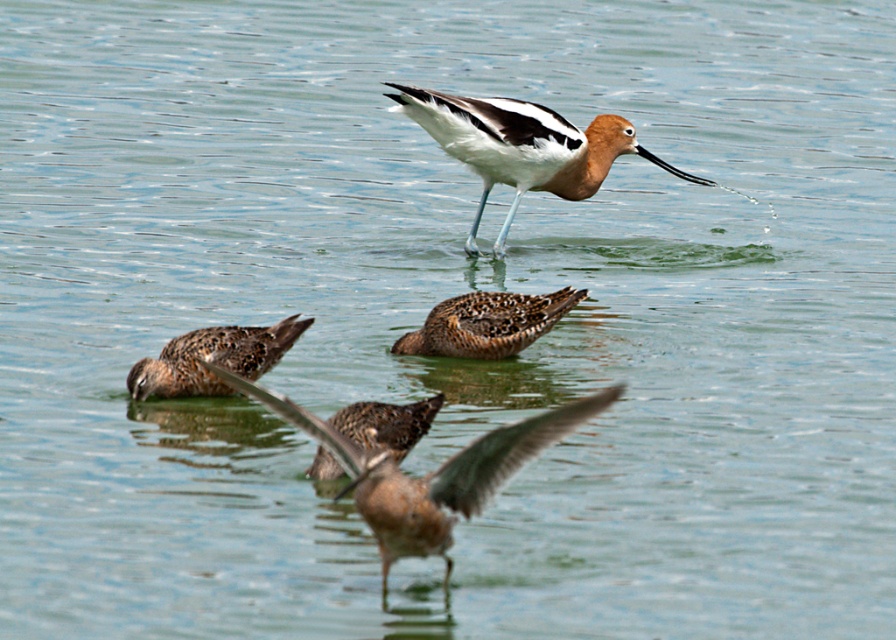
Question: Which is nearer to the brown speckled bird at center?

Choices:
 (A) brown speckled duck at lower center
 (B) brown speckled duck at center
 (C) brown speckled duck at lower left

Answer: (A)

Question: Can you confirm if brown speckled duck at lower left is wider than brown speckled duck at lower center?

Choices:
 (A) yes
 (B) no

Answer: (A)

Question: Observing the image, what is the correct spatial positioning of brown speckled bird at center in reference to brown speckled duck at center?

Choices:
 (A) left
 (B) right

Answer: (A)

Question: Is brown speckled bird at center behind brown speckled duck at lower center?

Choices:
 (A) yes
 (B) no

Answer: (B)

Question: Which point is farther from the camera taking this photo?

Choices:
 (A) (225, 381)
 (B) (562, 120)
 (C) (191, 355)

Answer: (B)

Question: Among these points, which one is nearest to the camera?

Choices:
 (A) (421, 401)
 (B) (269, 365)
 (C) (438, 348)

Answer: (A)